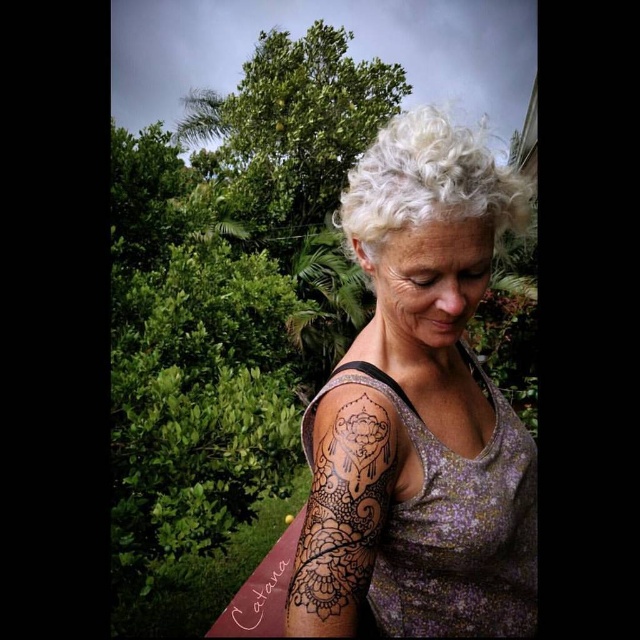
You are a photographer planning to take a portrait of the person in the scene. You want to ensure both the black henna tattoo at upper right and the white curly hair at upper center are clearly visible. Based on their positions, which object should you focus on first to ensure proper exposure?

The black henna tattoo at upper right is below the white curly hair at upper center. Since the white curly hair at upper center is higher up, focusing on it first might help balance the exposure for both elements, ensuring neither is overexposed or underexposed.

You are a photographer trying to capture the intricate details of the black henna tattoo at upper right. You want to ensure that the tattoo is centered in your shot. Given that the camera focuses on the point at point (419, 412), will the tattoo be centered in the image?

Yes, the black henna tattoo at upper right is located exactly at point (419, 412), so the camera focusing on that point will center the tattoo in the image.